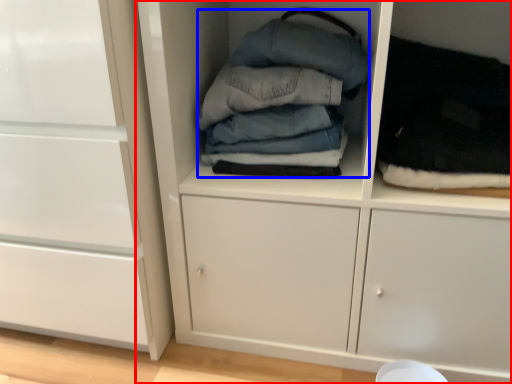
Question: Among these objects, which one is farthest to the camera, cupboard (highlighted by a red box) or clothing (highlighted by a blue box)?

Choices:
 (A) cupboard
 (B) clothing

Answer: (B)